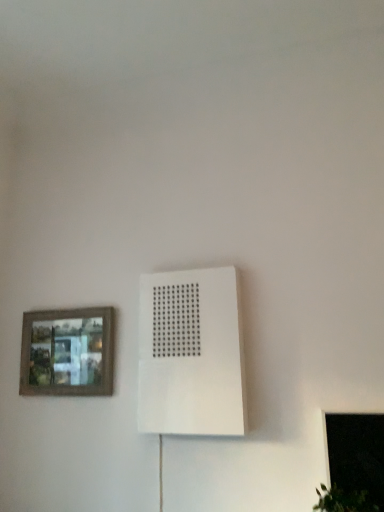
Question: In terms of height, does white matte air conditioning at center look taller or shorter compared to transparent glass window at lower right?

Choices:
 (A) tall
 (B) short

Answer: (A)

Question: Considering their positions, is white matte air conditioning at center located in front of or behind transparent glass window at lower right?

Choices:
 (A) front
 (B) behind

Answer: (B)

Question: Which object is positioned farthest from the white matte air conditioning at center?

Choices:
 (A) transparent glass window at lower right
 (B) wooden framed picture at left

Answer: (A)

Question: Which is nearer to the transparent glass window at lower right?

Choices:
 (A) white matte air conditioning at center
 (B) wooden framed picture at left

Answer: (A)